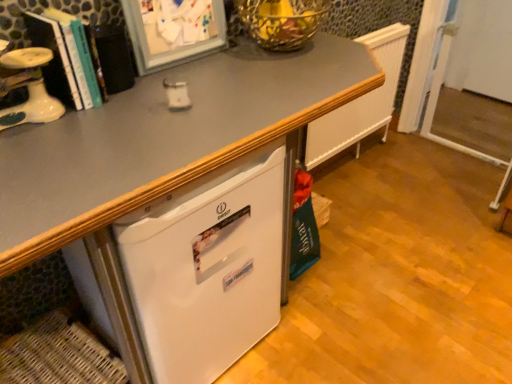
Identify the location of vacant space to the right of white glossy desk at center. (397, 281).